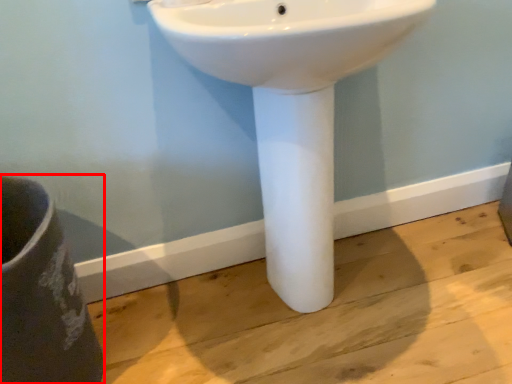
Question: From the image's perspective, considering the relative positions of porcelain (annotated by the red box) and sink in the image provided, where is porcelain (annotated by the red box) located with respect to the staircase?

Choices:
 (A) below
 (B) above

Answer: (A)